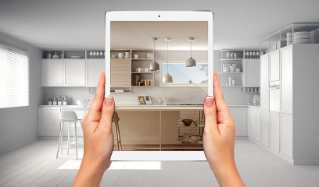
This screenshot has width=319, height=187. What are the coordinates of `cabinet` in the screenshot? It's located at (120, 65).